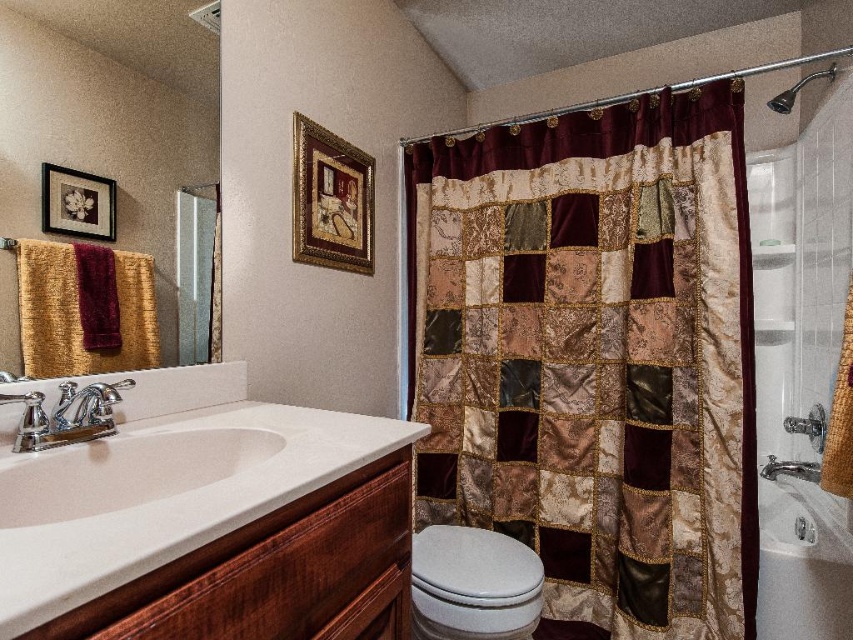
Does point (624, 493) come closer to viewer compared to point (62, 316)?

No, (624, 493) is further to viewer.

Which is in front, point (489, 230) or point (21, 324)?

Positioned in front is point (21, 324).

Find the location of `patchwork fabric shower curtain at center`. patchwork fabric shower curtain at center is located at coordinates (595, 356).

Who is more distant from viewer, (247, 465) or (839, 531)?

The point (839, 531) is more distant.

Can you confirm if white glossy sink at center is wider than white ceramic bathtub at lower right?

Correct, the width of white glossy sink at center exceeds that of white ceramic bathtub at lower right.

Is point (271, 445) closer to camera compared to point (782, 556)?

That is True.

The image size is (853, 640). Find the location of `white glossy sink at center`. white glossy sink at center is located at coordinates (125, 467).

Between point (711, 218) and point (33, 449), which one is positioned behind?

Point (711, 218)

Can you confirm if patchwork fabric shower curtain at center is positioned to the right of chrome/metallic faucet at sink left?

Correct, you'll find patchwork fabric shower curtain at center to the right of chrome/metallic faucet at sink left.

Is point (503, 339) in front of point (44, 433)?

No, it is not.

Locate an element on the screen. patchwork fabric shower curtain at center is located at coordinates (595, 356).